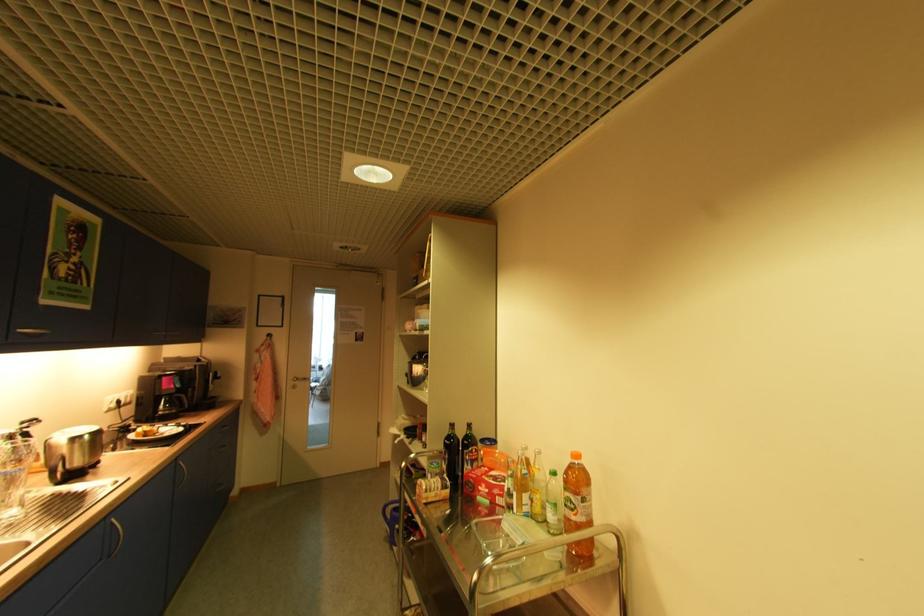
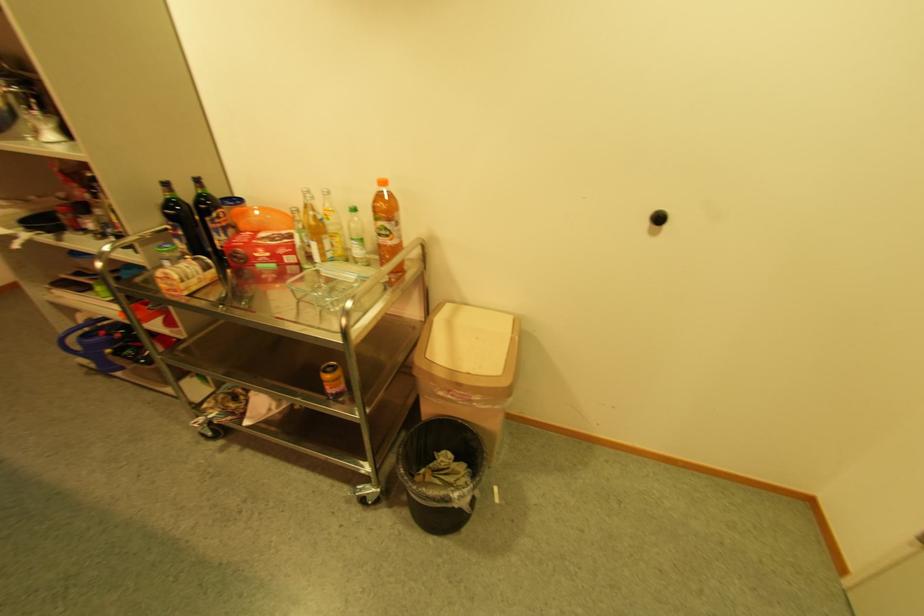
In the second image, find the point that corresponds to the point at 575,506 in the first image.

(391, 233)